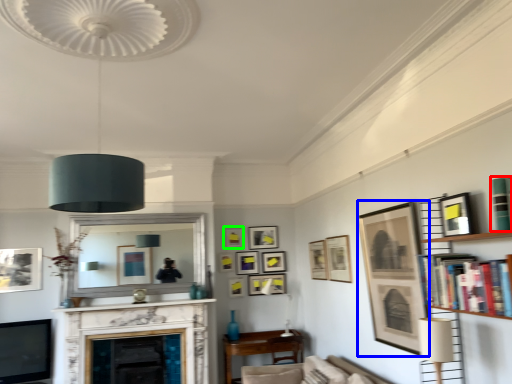
Question: Which object is the closest to the book (highlighted by a red box)? Choose among these: picture frame (highlighted by a blue box) or picture frame (highlighted by a green box).

Choices:
 (A) picture frame
 (B) picture frame

Answer: (A)